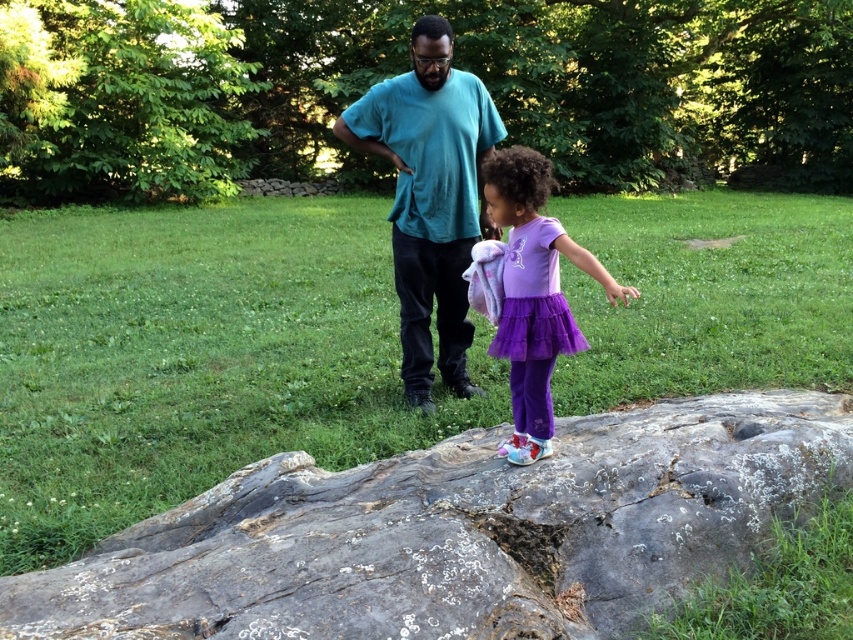
You are a fashion designer observing a young girl wearing a teal matte shirt at center and a purple tulle skirt at center. Which clothing item is located to the left of the other?

The teal matte shirt at center is positioned on the left side of purple tulle skirt at center.